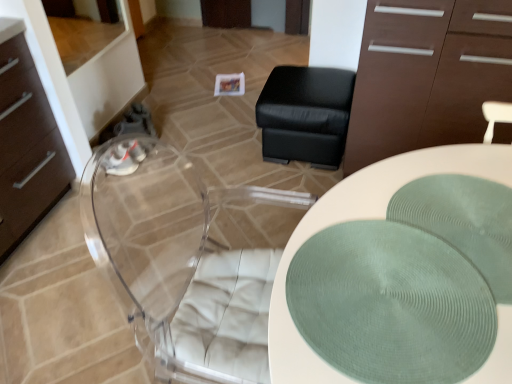
Find the location of a particular element. This screenshot has width=512, height=384. empty space that is ontop of transparent acrylic swivel chair at center (from a real-world perspective) is located at coordinates (166, 218).